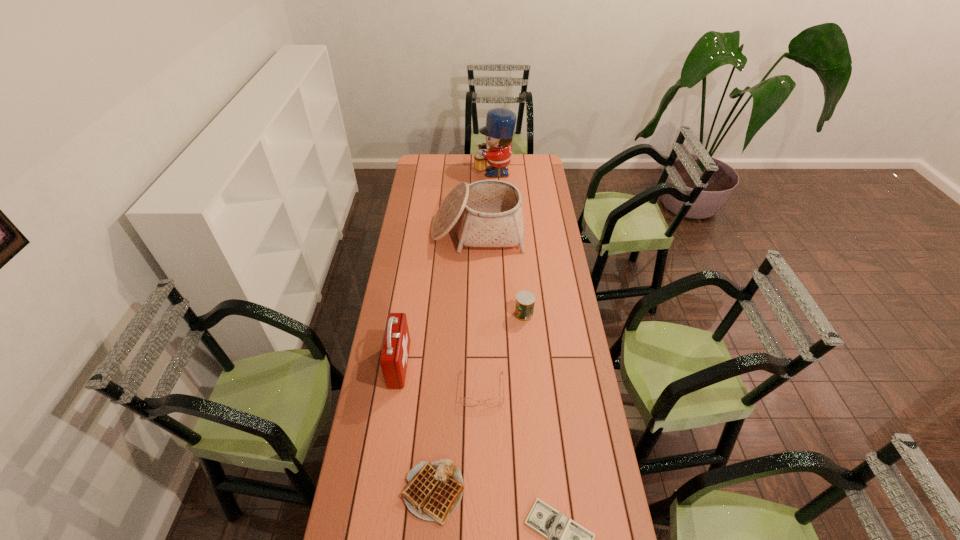
Identify which object is the third nearest to the third farthest object. Please provide its 2D coordinates. Your answer should be formatted as a tuple, i.e. [(x, y)], where the tuple contains the x and y coordinates of a point satisfying the conditions above.

[(395, 350)]

Identify which object is the second closest to the dollar. Please provide its 2D coordinates. Your answer should be formatted as a tuple, i.e. [(x, y)], where the tuple contains the x and y coordinates of a point satisfying the conditions above.

[(494, 402)]

Where is `free space in the image that satisfies the following two spatial constraints: 1. on the back side of the waffle; 2. on the front face of the first-aid kit`? The height and width of the screenshot is (540, 960). free space in the image that satisfies the following two spatial constraints: 1. on the back side of the waffle; 2. on the front face of the first-aid kit is located at coordinates (443, 364).

Where is `vacant area in the image that satisfies the following two spatial constraints: 1. on the front-facing side of the nutcracker; 2. on the front-facing side of the spectacles`? Image resolution: width=960 pixels, height=540 pixels. vacant area in the image that satisfies the following two spatial constraints: 1. on the front-facing side of the nutcracker; 2. on the front-facing side of the spectacles is located at coordinates (502, 389).

Find the location of a particular element. Image resolution: width=960 pixels, height=540 pixels. vacant region that satisfies the following two spatial constraints: 1. with the lid open on the can; 2. on the right side of the sixth nearest object is located at coordinates (477, 314).